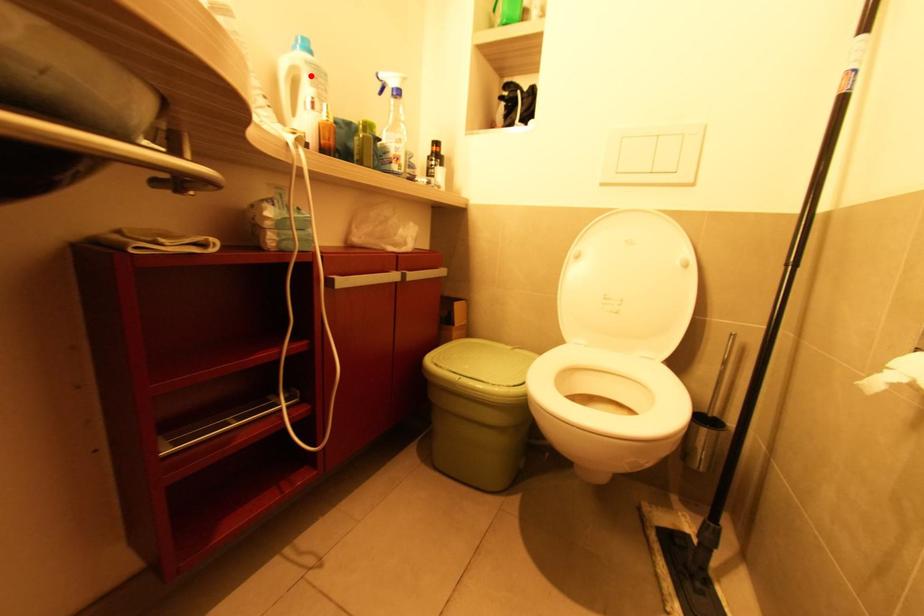
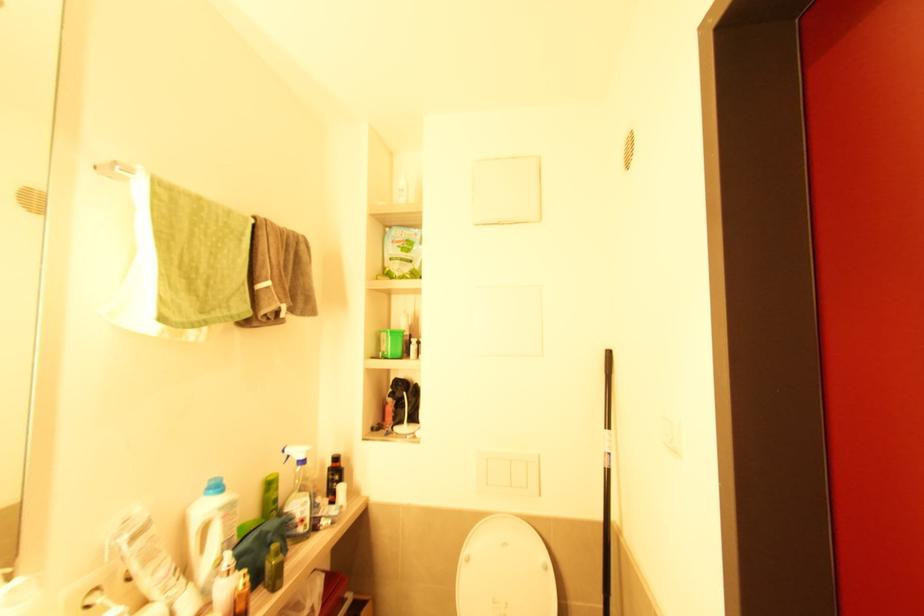
Question: I am providing you with two images of the same scene from different viewpoints. A red point is marked on the first image. Can you still see the location of the red point in image 2?

Choices:
 (A) Yes
 (B) No

Answer: (A)